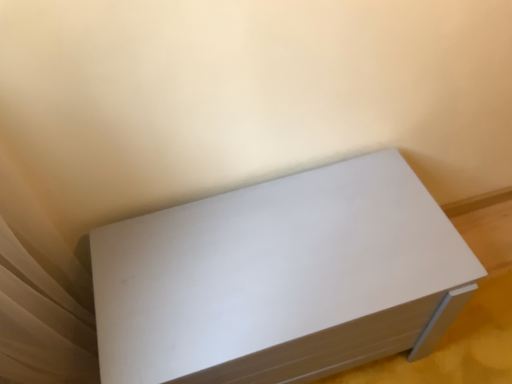
This screenshot has height=384, width=512. Identify the location of blank space situated above white matte table at center (from a real-world perspective). (189, 281).